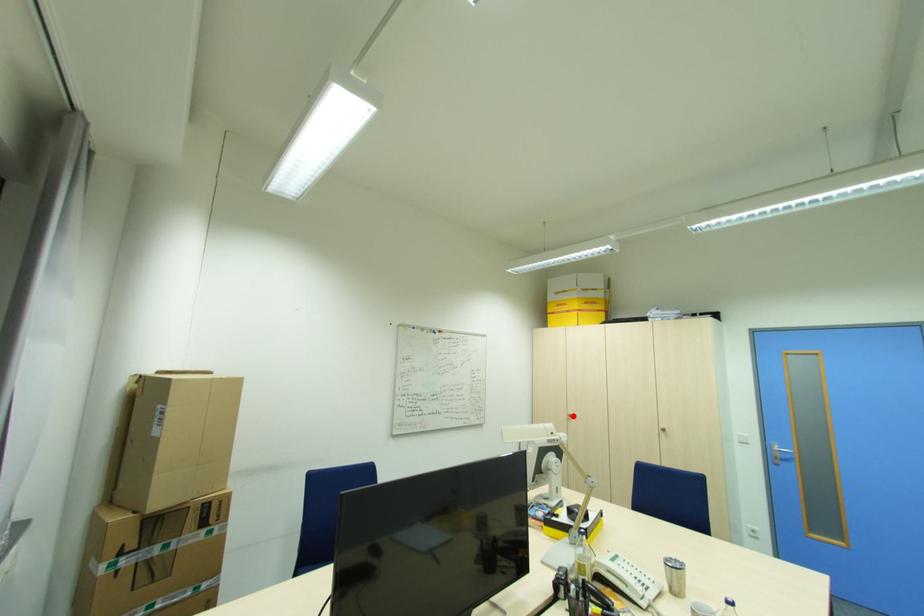
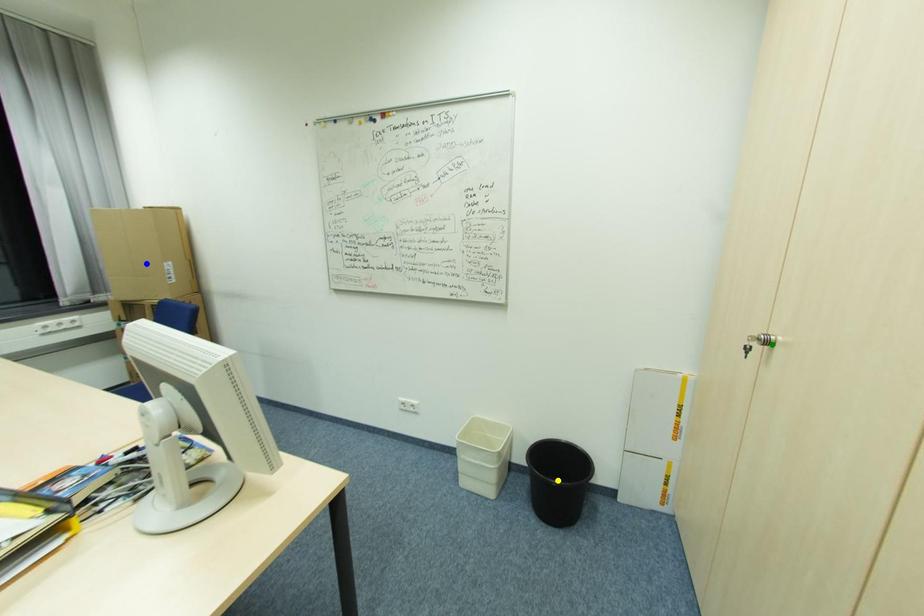
Question: I am providing you with two images of the same scene from different viewpoints. A red point is marked on the first image. You are given multiple points on the second image. In image 2, which mark is for the same physical point as the one in image 1?

Choices:
 (A) blue point
 (B) yellow point
 (C) green point

Answer: (C)